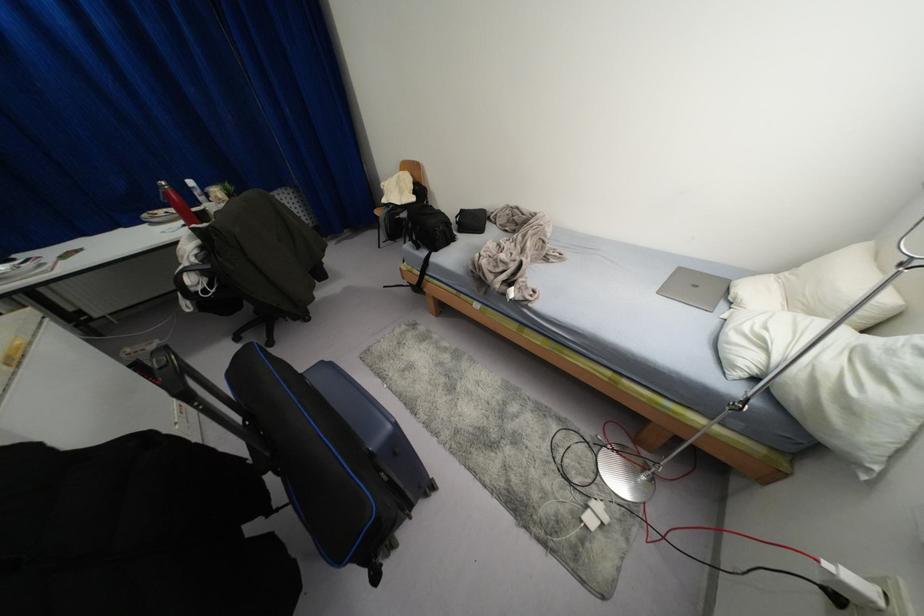
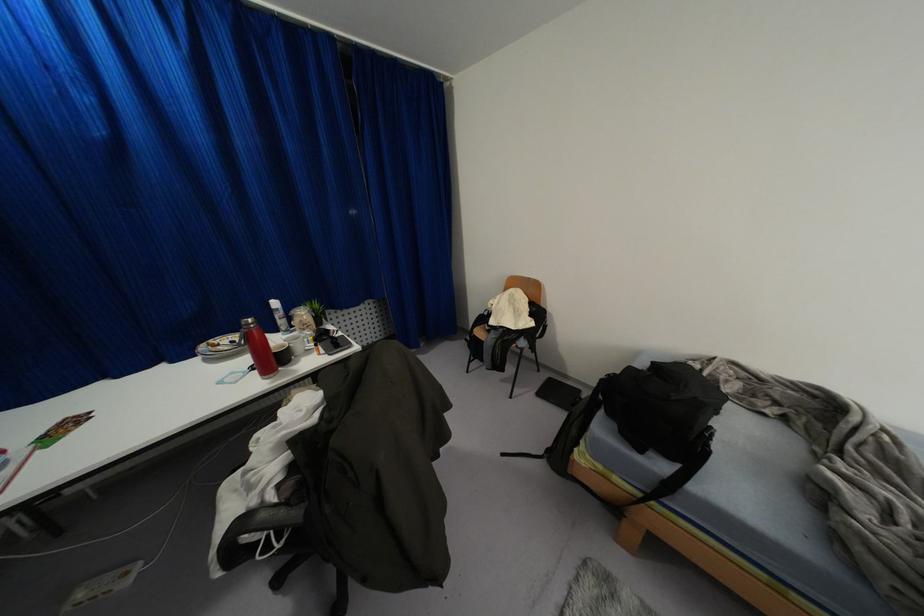
Which direction would the cameraman need to move to produce the second image?

The cameraman moved toward left, forward.